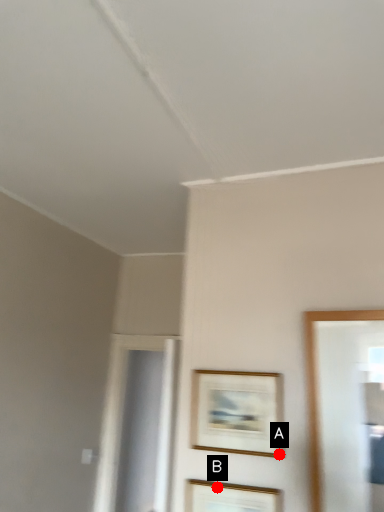
Question: Two points are circled on the image, labeled by A and B beside each circle. Which of the following is the farthest from the observer?

Choices:
 (A) A is further
 (B) B is further

Answer: (B)